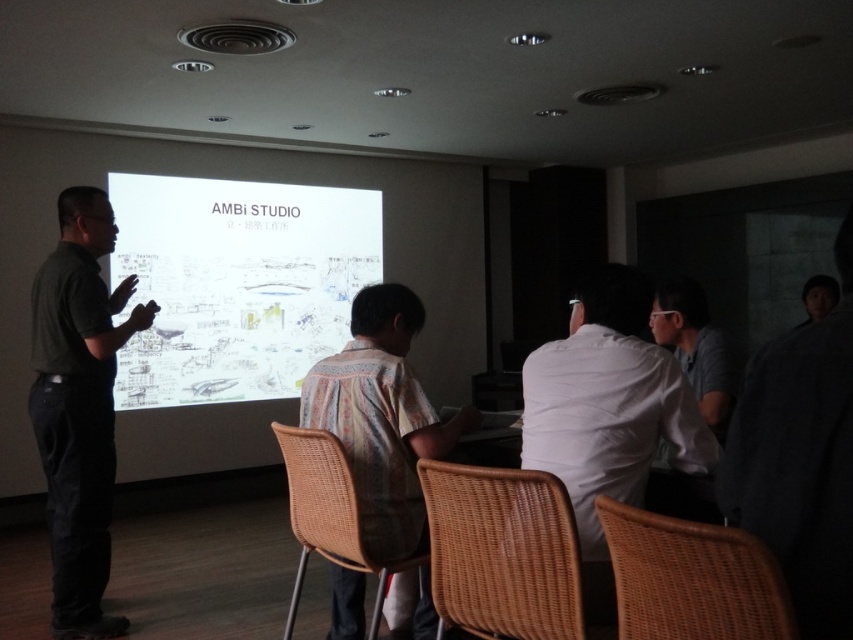
Question: Is the position of white paper at center more distant than that of dark green shirt at left?

Choices:
 (A) no
 (B) yes

Answer: (B)

Question: Can you confirm if white matte shirt at center is positioned above dark green shirt at left?

Choices:
 (A) no
 (B) yes

Answer: (B)

Question: Which point appears farthest from the camera in this image?

Choices:
 (A) (659, 544)
 (B) (318, 528)
 (C) (418, 573)

Answer: (C)

Question: Which object is positioned closest to the white paper at center?

Choices:
 (A) woven brown chair at lower center
 (B) woven brown chair at lower right

Answer: (A)

Question: Which is nearer to the white paper at center?

Choices:
 (A) dark green shirt at left
 (B) woven brown chair at lower center

Answer: (A)

Question: Does white paper at center appear under woven brown chair at lower center?

Choices:
 (A) no
 (B) yes

Answer: (A)